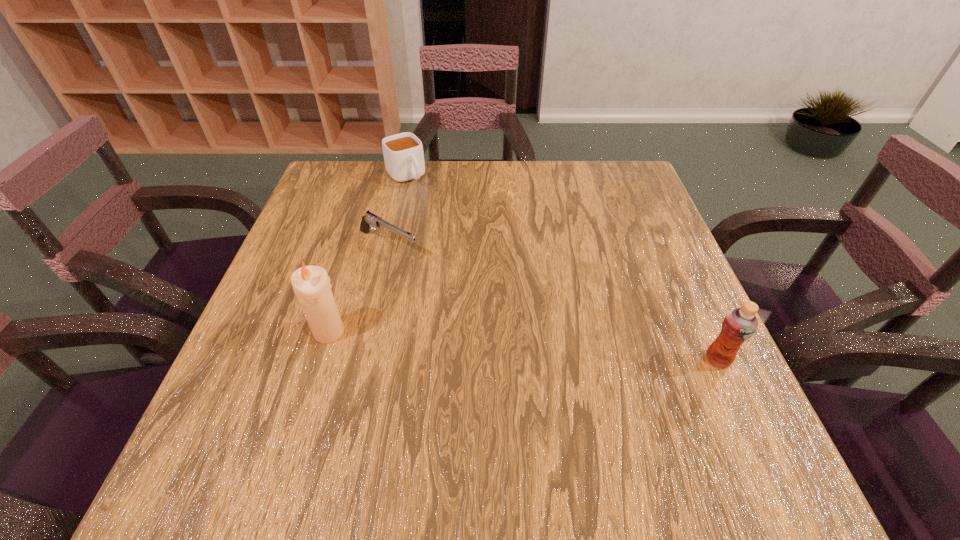
Identify the location of vacant region that satisfies the following two spatial constraints: 1. on the back side of the candle; 2. on the left side of the third tallest object. This screenshot has width=960, height=540. (376, 176).

At what (x,y) coordinates should I click in order to perform the action: click on vacant area in the image that satisfies the following two spatial constraints: 1. on the front side of the cup; 2. on the right side of the orange juice. Please return your answer as a coordinate pair (x, y). Looking at the image, I should click on (365, 360).